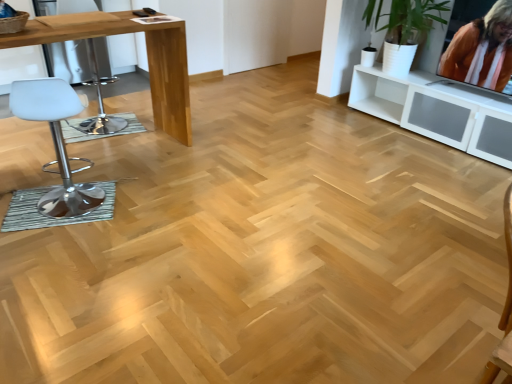
Question: Is orange fabric at upper right at the right side of white leather stool at left?

Choices:
 (A) yes
 (B) no

Answer: (A)

Question: Can you confirm if orange fabric at upper right is thinner than white leather stool at left?

Choices:
 (A) yes
 (B) no

Answer: (A)

Question: Does orange fabric at upper right have a lesser height compared to white leather stool at left?

Choices:
 (A) yes
 (B) no

Answer: (A)

Question: From the image's perspective, is orange fabric at upper right located beneath white leather stool at left?

Choices:
 (A) yes
 (B) no

Answer: (B)

Question: Would you consider orange fabric at upper right to be distant from white leather stool at left?

Choices:
 (A) yes
 (B) no

Answer: (A)

Question: Based on their positions, is white leather stool at left located to the left or right of light brown glossy table at left?

Choices:
 (A) right
 (B) left

Answer: (A)

Question: From their relative heights in the image, would you say white leather stool at left is taller or shorter than light brown glossy table at left?

Choices:
 (A) short
 (B) tall

Answer: (A)

Question: Is white leather stool at left in front of or behind light brown glossy table at left in the image?

Choices:
 (A) behind
 (B) front

Answer: (B)

Question: From the image's perspective, is white leather stool at left positioned above or below light brown glossy table at left?

Choices:
 (A) above
 (B) below

Answer: (B)

Question: Choose the correct answer: Is light brown glossy table at left inside white plastic swivel chair at left or outside it?

Choices:
 (A) inside
 (B) outside

Answer: (B)

Question: Is light brown glossy table at left to the left or to the right of white plastic swivel chair at left in the image?

Choices:
 (A) left
 (B) right

Answer: (B)

Question: Considering the positions of light brown glossy table at left and white plastic swivel chair at left in the image, is light brown glossy table at left wider or thinner than white plastic swivel chair at left?

Choices:
 (A) wide
 (B) thin

Answer: (A)

Question: From the image's perspective, is light brown glossy table at left located above or below white plastic swivel chair at left?

Choices:
 (A) above
 (B) below

Answer: (B)

Question: In terms of height, does orange fabric at upper right look taller or shorter compared to light brown glossy table at left?

Choices:
 (A) short
 (B) tall

Answer: (A)

Question: Is point (497, 4) closer or farther from the camera than point (159, 81)?

Choices:
 (A) closer
 (B) farther

Answer: (A)